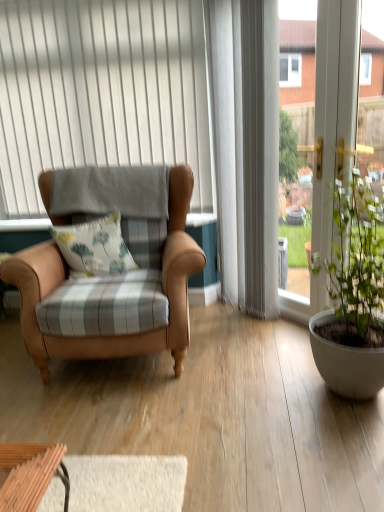
Question: Does leather armchair at left have a lesser height compared to matte white pot at right?

Choices:
 (A) no
 (B) yes

Answer: (A)

Question: Considering the relative positions of leather armchair at left and matte white pot at right in the image provided, is leather armchair at left to the left of matte white pot at right from the viewer's perspective?

Choices:
 (A) yes
 (B) no

Answer: (A)

Question: Is leather armchair at left outside of matte white pot at right?

Choices:
 (A) yes
 (B) no

Answer: (A)

Question: From a real-world perspective, is leather armchair at left located beneath matte white pot at right?

Choices:
 (A) yes
 (B) no

Answer: (B)

Question: Is leather armchair at left at the right side of matte white pot at right?

Choices:
 (A) yes
 (B) no

Answer: (B)

Question: Is leather armchair at left facing away from matte white pot at right?

Choices:
 (A) no
 (B) yes

Answer: (A)

Question: From a real-world perspective, is matte white pot at right beneath white textured curtain at upper center?

Choices:
 (A) yes
 (B) no

Answer: (A)

Question: Does matte white pot at right lie in front of white textured curtain at upper center?

Choices:
 (A) yes
 (B) no

Answer: (A)

Question: Is white textured curtain at upper center located within matte white pot at right?

Choices:
 (A) no
 (B) yes

Answer: (A)

Question: Are matte white pot at right and white textured curtain at upper center far apart?

Choices:
 (A) yes
 (B) no

Answer: (A)

Question: From the image's perspective, is matte white pot at right on top of white textured curtain at upper center?

Choices:
 (A) no
 (B) yes

Answer: (A)

Question: From a real-world perspective, is matte white pot at right located higher than white textured curtain at upper center?

Choices:
 (A) no
 (B) yes

Answer: (A)

Question: Is leather armchair at left located outside white textured curtain at upper center?

Choices:
 (A) yes
 (B) no

Answer: (A)